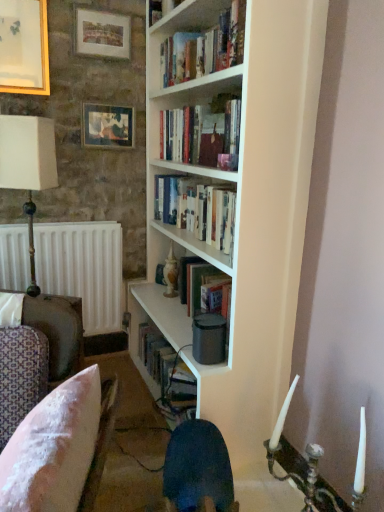
What do you see at coordinates (83, 269) in the screenshot? I see `white matte radiator at left` at bounding box center [83, 269].

Identify the location of wooden picture frame at upper left, the 1th picture frame viewed from the left. (24, 47).

What is the approximate width of white matte bookcase at center?

It is 14.90 inches.

What are the coordinates of `white paperbacks at upper center, which is the 1th book in top-to-bottom order` in the screenshot? It's located at (204, 48).

In the scene shown: How many degrees apart are the facing directions of white fabric-covered lampshade at left and white matte radiator at left?

29.5 degrees separate the facing orientations of white fabric-covered lampshade at left and white matte radiator at left.

Which object is thinner, white fabric-covered lampshade at left or white matte radiator at left?

white matte radiator at left.

Is white matte radiator at left completely or partially inside white fabric-covered lampshade at left?

No, white matte radiator at left is located outside of white fabric-covered lampshade at left.

Identify the location of table lamp above the white matte radiator at left (from the image's perspective). The width and height of the screenshot is (384, 512). (28, 166).

Is white matte bookcase at center wider than pink fabric cushion at lower left?

Yes, white matte bookcase at center is wider than pink fabric cushion at lower left.

From the image's perspective, would you say white matte bookcase at center is positioned over pink fabric cushion at lower left?

Yes, from the image's perspective, white matte bookcase at center is over pink fabric cushion at lower left.

Which is behind, point (272, 414) or point (45, 430)?

The point (272, 414) is farther.

Can you tell me how much white matte bookcase at center and pink fabric cushion at lower left differ in facing direction?

The facing directions of white matte bookcase at center and pink fabric cushion at lower left are 18.2 degrees apart.

How distant is pink fabric cushion at lower left from white paperbacks at upper center, which is the 1th book in top-to-bottom order?

pink fabric cushion at lower left and white paperbacks at upper center, which is the 1th book in top-to-bottom order, are 4.33 feet apart.

What are the coordinates of `chair located underneath the white paperbacks at upper center, which is the 1th book in top-to-bottom order (from a real-world perspective)` in the screenshot? It's located at (60, 448).

Is white paperbacks at upper center, which is the 1th book in top-to-bottom order, at the back of pink fabric cushion at lower left?

No, pink fabric cushion at lower left is not facing the opposite direction of white paperbacks at upper center, which is the 1th book in top-to-bottom order.

From the image's perspective, who appears lower, pink fabric cushion at lower left or white paperbacks at upper center, the second book positioned from the bottom?

pink fabric cushion at lower left is shown below in the image.

Between white matte bookcase at center and wooden picture frame at upper left, which appears as the 3th picture frame when viewed from the right, which one has smaller width?

With smaller width is wooden picture frame at upper left, which appears as the 3th picture frame when viewed from the right.

Is point (271, 272) in front of point (26, 21)?

Yes, point (271, 272) is in front of point (26, 21).

Locate an element on the screen. Image resolution: width=384 pixels, height=512 pixels. the 1st picture frame behind the white matte bookcase at center is located at coordinates (24, 47).

Is there a large distance between pink fabric cushion at lower left and wooden picture frame at upper left, which appears as the 3th picture frame when viewed from the right?

Indeed, pink fabric cushion at lower left is not near wooden picture frame at upper left, which appears as the 3th picture frame when viewed from the right.

Between pink fabric cushion at lower left and wooden picture frame at upper left, the 1th picture frame viewed from the left, which one has larger width?

pink fabric cushion at lower left.

From the image's perspective, which is above, pink fabric cushion at lower left or wooden picture frame at upper left, which appears as the 3th picture frame when viewed from the right?

wooden picture frame at upper left, which appears as the 3th picture frame when viewed from the right, from the image's perspective.

Is pink fabric cushion at lower left looking in the opposite direction of wooden picture frame at upper left, the 1th picture frame viewed from the left?

pink fabric cushion at lower left does not have its back to wooden picture frame at upper left, the 1th picture frame viewed from the left.

Is matte wooden picture frame at upper center, which ranks as the second picture frame in left-to-right order, touching white matte bookcase at center?

No, matte wooden picture frame at upper center, which ranks as the second picture frame in left-to-right order, is not next to white matte bookcase at center.

Considering the positions of points (80, 38) and (189, 120), is point (80, 38) farther from camera compared to point (189, 120)?

Yes, point (80, 38) is behind point (189, 120).

From the image's perspective, is matte wooden picture frame at upper center, the 2th picture frame viewed from the right, located above or below white matte bookcase at center?

matte wooden picture frame at upper center, the 2th picture frame viewed from the right, is situated higher than white matte bookcase at center in the image.

Considering the relative sizes of matte wooden picture frame at upper center, the 2th picture frame viewed from the right, and white matte bookcase at center in the image provided, is matte wooden picture frame at upper center, the 2th picture frame viewed from the right, shorter than white matte bookcase at center?

Correct, matte wooden picture frame at upper center, the 2th picture frame viewed from the right, is not as tall as white matte bookcase at center.

Based on the photo, does white matte radiator at left contain white fabric-covered lampshade at left?

No, white fabric-covered lampshade at left is not surrounded by white matte radiator at left.

Which of these two, white matte radiator at left or white fabric-covered lampshade at left, is smaller?

white fabric-covered lampshade at left.

Is white matte radiator at left in front of or behind white fabric-covered lampshade at left in the image?

In the image, white matte radiator at left appears behind white fabric-covered lampshade at left.

Is point (97, 254) more distant than point (33, 215)?

Yes.

Locate an element on the screen. This screenshot has height=512, width=384. radiator beneath the white fabric-covered lampshade at left (from a real-world perspective) is located at coordinates (83, 269).

Find the location of a particular element. The image size is (384, 512). chair lying below the white matte bookcase at center (from the image's perspective) is located at coordinates (60, 448).

Looking at this image, looking at the image, which one is located further to white paperbacks at upper center, which is the 1th book in top-to-bottom order, wooden picture frame at upper left, which appears as the 3th picture frame when viewed from the right, or pink fabric cushion at lower left?

pink fabric cushion at lower left lies further to white paperbacks at upper center, which is the 1th book in top-to-bottom order, than the other object.

Considering their positions, is white matte bookcase at center positioned closer to matte wooden picture frame at upper center, which ranks as the second picture frame in left-to-right order, than white paperbacks at upper center, the second book positioned from the bottom?

white paperbacks at upper center, the second book positioned from the bottom, is closer to matte wooden picture frame at upper center, which ranks as the second picture frame in left-to-right order.

Based on their spatial positions, is matte wooden picture frame at upper center, the 2th picture frame viewed from the right, or pink fabric cushion at lower left further from white fabric-covered lampshade at left?

pink fabric cushion at lower left.

When comparing their distances from wooden picture frame at upper left, the 1th picture frame viewed from the left, does white fabric-covered lampshade at left or hardcover books at center, the second book viewed from the top, seem further?

hardcover books at center, the second book viewed from the top, lies further to wooden picture frame at upper left, the 1th picture frame viewed from the left, than the other object.

Based on the photo, considering their positions, is white matte bookcase at center positioned further to pink fabric cushion at lower left than white fabric-covered lampshade at left?

white fabric-covered lampshade at left is positioned further to the anchor pink fabric cushion at lower left.

Estimate the real-world distances between objects in this image. Which object is closer to white paperbacks at upper center, the second book positioned from the bottom, white matte bookcase at center or white matte radiator at left?

white matte bookcase at center is positioned closer to the anchor white paperbacks at upper center, the second book positioned from the bottom.

Which object lies nearer to the anchor point wooden picture frame at upper left, which appears as the 3th picture frame when viewed from the right, matte wooden picture frame at upper left, arranged as the third picture frame when viewed from the left, or white matte bookcase at center?

matte wooden picture frame at upper left, arranged as the third picture frame when viewed from the left, lies closer to wooden picture frame at upper left, which appears as the 3th picture frame when viewed from the right, than the other object.

Which object lies nearer to the anchor point white matte bookcase at center, pink fabric cushion at lower left or hardcover books at center, the second book viewed from the top?

Among the two, hardcover books at center, the second book viewed from the top, is located nearer to white matte bookcase at center.

At what (x,y) coordinates should I click in order to perform the action: click on table lamp between matte wooden picture frame at upper center, which ranks as the second picture frame in left-to-right order, and pink fabric cushion at lower left, in the vertical direction. Please return your answer as a coordinate pair (x, y). The height and width of the screenshot is (512, 384). Looking at the image, I should click on (28, 166).

Locate an element on the screen. table lamp between wooden picture frame at upper left, which appears as the 3th picture frame when viewed from the right, and white matte radiator at left vertically is located at coordinates (28, 166).

This screenshot has width=384, height=512. In order to click on book positioned between white matte bookcase at center and hardcover books at center, the second book viewed from the top, from near to far in this screenshot , I will do `click(204, 48)`.

I want to click on picture frame between white matte bookcase at center and matte wooden picture frame at upper center, which ranks as the second picture frame in left-to-right order, along the z-axis, so click(24, 47).